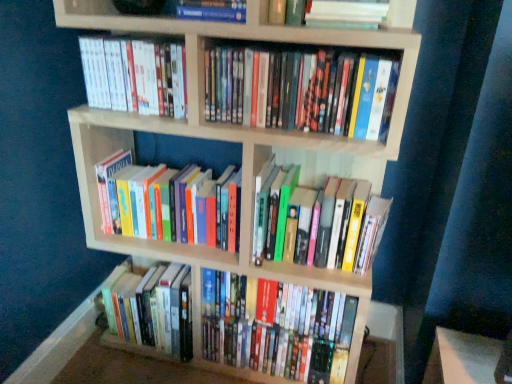
Question: In which direction should I rotate to look at hardcover books at center, which appears as the 6th book when viewed from the top?

Choices:
 (A) left
 (B) right

Answer: (B)

Question: Does hardcover book at upper center, placed as the first book when sorted from top to bottom, have a larger size compared to hardcover books at center, which appears as the 6th book when viewed from the top?

Choices:
 (A) yes
 (B) no

Answer: (B)

Question: Is hardcover book at upper center, placed as the first book when sorted from top to bottom, far away from hardcover books at center, which appears as the 6th book when viewed from the top?

Choices:
 (A) no
 (B) yes

Answer: (A)

Question: Considering the relative positions of hardcover book at upper center, the eighth book from the bottom, and hardcover books at center, which appears as the 6th book when viewed from the top, in the image provided, is hardcover book at upper center, the eighth book from the bottom, in front of hardcover books at center, which appears as the 6th book when viewed from the top,?

Choices:
 (A) yes
 (B) no

Answer: (A)

Question: Is hardcover book at upper center, the eighth book from the bottom, smaller than hardcover books at center, which appears as the 6th book when viewed from the top?

Choices:
 (A) yes
 (B) no

Answer: (A)

Question: Does hardcover book at upper center, the eighth book from the bottom, have a lesser height compared to hardcover books at center, which appears as the 6th book when viewed from the top?

Choices:
 (A) no
 (B) yes

Answer: (B)

Question: Is hardcover book at upper center, placed as the first book when sorted from top to bottom, facing away from hardcover books at center, which appears as the 6th book when viewed from the top?

Choices:
 (A) no
 (B) yes

Answer: (A)

Question: Considering the relative sizes of hardcover book at upper center, placed as the first book when sorted from top to bottom, and hardcover books at lower left, which ranks as the seventh book in top-to-bottom order, in the image provided, is hardcover book at upper center, placed as the first book when sorted from top to bottom, bigger than hardcover books at lower left, which ranks as the seventh book in top-to-bottom order,?

Choices:
 (A) yes
 (B) no

Answer: (B)

Question: Is hardcover book at upper center, placed as the first book when sorted from top to bottom, shorter than hardcover books at lower left, which ranks as the seventh book in top-to-bottom order?

Choices:
 (A) no
 (B) yes

Answer: (B)

Question: Can you confirm if hardcover book at upper center, the eighth book from the bottom, is smaller than hardcover books at lower left, which is the second book from bottom to top?

Choices:
 (A) yes
 (B) no

Answer: (A)

Question: Is hardcover book at upper center, placed as the first book when sorted from top to bottom, aimed at hardcover books at lower left, which is the second book from bottom to top?

Choices:
 (A) yes
 (B) no

Answer: (B)

Question: Is hardcover book at upper center, the eighth book from the bottom, behind hardcover books at lower left, which ranks as the seventh book in top-to-bottom order?

Choices:
 (A) no
 (B) yes

Answer: (A)

Question: From a real-world perspective, is hardcover book at upper center, placed as the first book when sorted from top to bottom, under hardcover books at lower left, which is the second book from bottom to top?

Choices:
 (A) yes
 (B) no

Answer: (B)

Question: Is the position of hardcover book at upper center, the eighth book from the bottom, more distant than that of white matte book at upper center, the 7th book from the bottom?

Choices:
 (A) no
 (B) yes

Answer: (A)